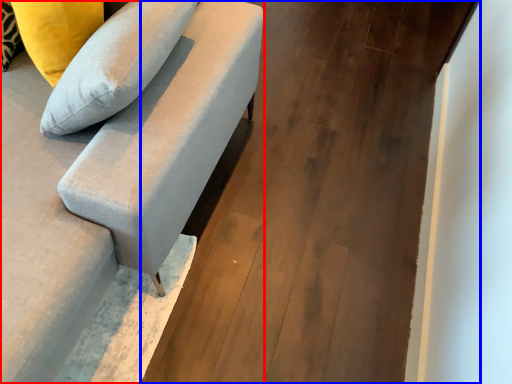
Question: Among these objects, which one is farthest to the camera, studio couch (highlighted by a red box) or concrete (highlighted by a blue box)?

Choices:
 (A) studio couch
 (B) concrete

Answer: (B)